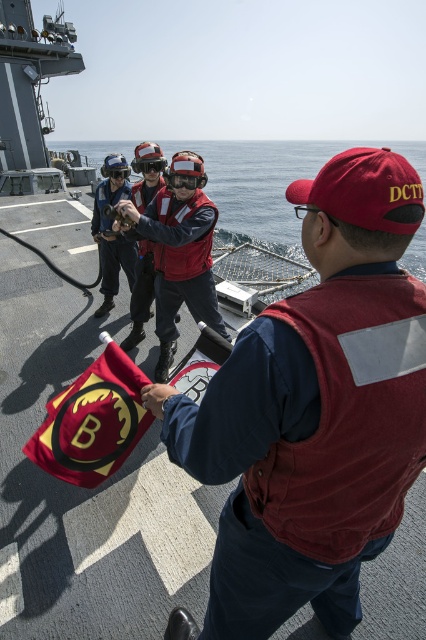
Who is more forward, (72, 141) or (155, 272)?

Point (155, 272) is in front.

In the scene shown: Is blue water at center below matte red life vest at center?

Actually, blue water at center is above matte red life vest at center.

Between point (262, 163) and point (178, 244), which one is positioned behind?

The point (262, 163) is more distant.

Identify the location of blue water at center. This screenshot has width=426, height=640. (258, 188).

Can you confirm if blue water at center is wider than red fabric flag at center?

Yes.

Does blue water at center appear on the right side of red fabric flag at center?

Yes, blue water at center is to the right of red fabric flag at center.

Locate an element on the screen. This screenshot has height=640, width=426. blue water at center is located at coordinates (258, 188).

Locate an element on the screen. This screenshot has height=640, width=426. blue water at center is located at coordinates (258, 188).

Which is above, red fabric flag at center or matte red life vest at center?

Positioned higher is matte red life vest at center.

Which is behind, point (100, 365) or point (184, 252)?

Positioned behind is point (184, 252).

Locate an element on the screen. red fabric flag at center is located at coordinates (92, 420).